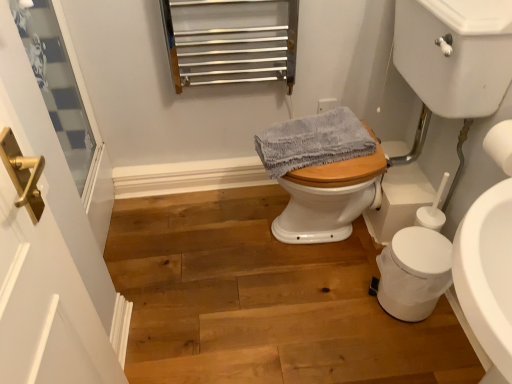
Question: Is point (40, 231) closer or farther from the camera than point (188, 301)?

Choices:
 (A) closer
 (B) farther

Answer: (A)

Question: Based on their positions, is white glass screen door at left located to the left or right of wooden floor at center?

Choices:
 (A) right
 (B) left

Answer: (B)

Question: Which object is the closest to the wooden floor at center?

Choices:
 (A) white matte trash can at lower right
 (B) white glossy sink at center right
 (C) white matte toilet paper at right
 (D) gray textured towel at center
 (E) clear glass door handle at left

Answer: (A)

Question: Which is farther from the clear glass door handle at left?

Choices:
 (A) gray textured towel at center
 (B) white glossy sink at center right
 (C) wooden floor at center
 (D) white matte toilet paper at right
 (E) white glass screen door at left

Answer: (D)